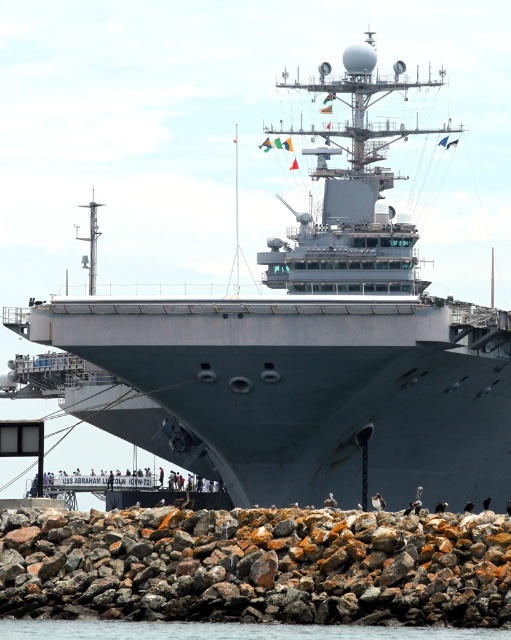
Question: Which object is farther from the camera taking this photo?

Choices:
 (A) transparent water at lower center
 (B) rusty rock at lower center

Answer: (B)

Question: Does rusty rock at lower center appear over transparent water at lower center?

Choices:
 (A) no
 (B) yes

Answer: (B)

Question: Which point appears closest to the camera in this image?

Choices:
 (A) (153, 637)
 (B) (323, 605)

Answer: (A)

Question: From the image, what is the correct spatial relationship of rusty rock at lower center in relation to transparent water at lower center?

Choices:
 (A) right
 (B) left

Answer: (A)

Question: Is the position of rusty rock at lower center more distant than that of transparent water at lower center?

Choices:
 (A) no
 (B) yes

Answer: (B)